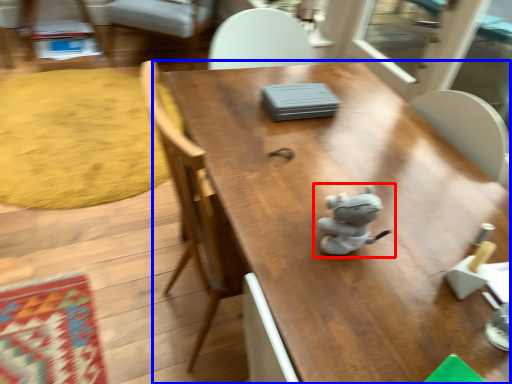
Question: Which object is further to the camera taking this photo, toy (highlighted by a red box) or table (highlighted by a blue box)?

Choices:
 (A) toy
 (B) table

Answer: (A)